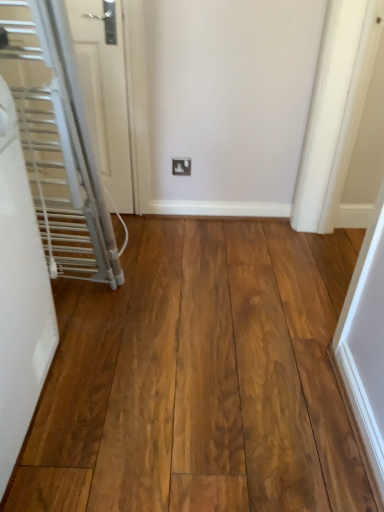
Question: Is white matte radiator at left, which appears as the 1th door when viewed from the front, aimed at white plastic outlet at center?

Choices:
 (A) no
 (B) yes

Answer: (A)

Question: Is there a large distance between white matte radiator at left, arranged as the 2th door when viewed from the back, and white plastic outlet at center?

Choices:
 (A) yes
 (B) no

Answer: (A)

Question: From the image's perspective, does white matte radiator at left, arranged as the 2th door when viewed from the back, appear higher than white plastic outlet at center?

Choices:
 (A) no
 (B) yes

Answer: (A)

Question: Considering the relative sizes of white matte radiator at left, arranged as the 2th door when viewed from the back, and white plastic outlet at center in the image provided, is white matte radiator at left, arranged as the 2th door when viewed from the back, bigger than white plastic outlet at center?

Choices:
 (A) no
 (B) yes

Answer: (B)

Question: Considering the relative sizes of white matte radiator at left, arranged as the 2th door when viewed from the back, and white plastic outlet at center in the image provided, is white matte radiator at left, arranged as the 2th door when viewed from the back, thinner than white plastic outlet at center?

Choices:
 (A) no
 (B) yes

Answer: (A)

Question: Is white plastic outlet at center bigger or smaller than white glossy door at left, arranged as the second door when viewed from the front?

Choices:
 (A) big
 (B) small

Answer: (B)

Question: Based on their positions, is white plastic outlet at center located to the left or right of white glossy door at left, arranged as the second door when viewed from the front?

Choices:
 (A) left
 (B) right

Answer: (B)

Question: Looking at their shapes, would you say white plastic outlet at center is wider or thinner than white glossy door at left, arranged as the second door when viewed from the front?

Choices:
 (A) wide
 (B) thin

Answer: (B)

Question: Is white plastic outlet at center inside or outside of white glossy door at left, placed as the 1th door when sorted from back to front?

Choices:
 (A) inside
 (B) outside

Answer: (B)

Question: Considering the positions of white matte radiator at left, which appears as the 1th door when viewed from the front, and white glossy door at left, arranged as the second door when viewed from the front, in the image, is white matte radiator at left, which appears as the 1th door when viewed from the front, taller or shorter than white glossy door at left, arranged as the second door when viewed from the front,?

Choices:
 (A) tall
 (B) short

Answer: (B)

Question: Relative to white glossy door at left, arranged as the second door when viewed from the front, is white matte radiator at left, which appears as the 1th door when viewed from the front, in front or behind?

Choices:
 (A) front
 (B) behind

Answer: (A)

Question: From a real-world perspective, is white matte radiator at left, arranged as the 2th door when viewed from the back, positioned above or below white glossy door at left, placed as the 1th door when sorted from back to front?

Choices:
 (A) above
 (B) below

Answer: (B)

Question: Is white matte radiator at left, which appears as the 1th door when viewed from the front, to the left or to the right of white glossy door at left, placed as the 1th door when sorted from back to front, in the image?

Choices:
 (A) right
 (B) left

Answer: (B)

Question: In terms of width, does white glossy door at left, arranged as the second door when viewed from the front, look wider or thinner when compared to white plastic outlet at center?

Choices:
 (A) wide
 (B) thin

Answer: (A)

Question: Is white glossy door at left, placed as the 1th door when sorted from back to front, spatially inside white plastic outlet at center, or outside of it?

Choices:
 (A) outside
 (B) inside

Answer: (A)